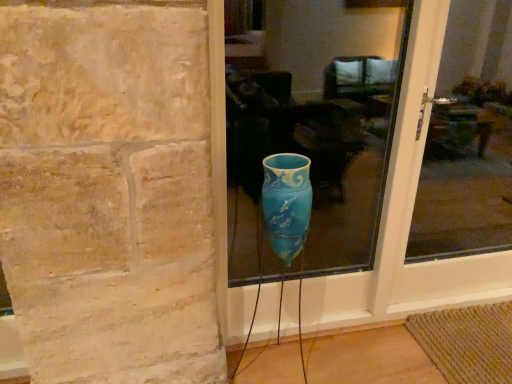
Question: Does transparent glass door at center, the 1th glass window when ordered from right to left, have a larger size compared to blue glass vase at center, marked as the 2th glass window in a right-to-left arrangement?

Choices:
 (A) yes
 (B) no

Answer: (A)

Question: Are transparent glass door at center, the 2th glass window from the left, and blue glass vase at center, marked as the 2th glass window in a right-to-left arrangement, located far from each other?

Choices:
 (A) yes
 (B) no

Answer: (B)

Question: Is the position of transparent glass door at center, the 1th glass window when ordered from right to left, less distant than that of blue glass vase at center, the first glass window positioned from the left?

Choices:
 (A) no
 (B) yes

Answer: (A)

Question: From a real-world perspective, is transparent glass door at center, the 1th glass window when ordered from right to left, physically above blue glass vase at center, marked as the 2th glass window in a right-to-left arrangement?

Choices:
 (A) no
 (B) yes

Answer: (A)

Question: Does transparent glass door at center, the 2th glass window from the left, have a greater width compared to blue glass vase at center, marked as the 2th glass window in a right-to-left arrangement?

Choices:
 (A) no
 (B) yes

Answer: (A)

Question: From the image's perspective, is transparent glass door at center, the 2th glass window from the left, under blue glass vase at center, the first glass window positioned from the left?

Choices:
 (A) yes
 (B) no

Answer: (A)

Question: Would you say blue glass vase at center, marked as the 2th glass window in a right-to-left arrangement, contains transparent glass door at center, the 2th glass window from the left?

Choices:
 (A) no
 (B) yes

Answer: (A)

Question: Would you consider blue glass vase at center, marked as the 2th glass window in a right-to-left arrangement, to be distant from transparent glass door at center, the 2th glass window from the left?

Choices:
 (A) no
 (B) yes

Answer: (A)

Question: Is blue glass vase at center, the first glass window positioned from the left, in front of transparent glass door at center, the 1th glass window when ordered from right to left?

Choices:
 (A) no
 (B) yes

Answer: (B)

Question: From a real-world perspective, is blue glass vase at center, marked as the 2th glass window in a right-to-left arrangement, physically below transparent glass door at center, the 2th glass window from the left?

Choices:
 (A) yes
 (B) no

Answer: (B)

Question: Does blue glass vase at center, the first glass window positioned from the left, have a greater height compared to transparent glass door at center, the 1th glass window when ordered from right to left?

Choices:
 (A) no
 (B) yes

Answer: (A)

Question: Does blue glass vase at center, marked as the 2th glass window in a right-to-left arrangement, have a greater width compared to transparent glass door at center, the 1th glass window when ordered from right to left?

Choices:
 (A) no
 (B) yes

Answer: (B)

Question: Is point (385, 142) closer or farther from the camera than point (440, 94)?

Choices:
 (A) farther
 (B) closer

Answer: (B)